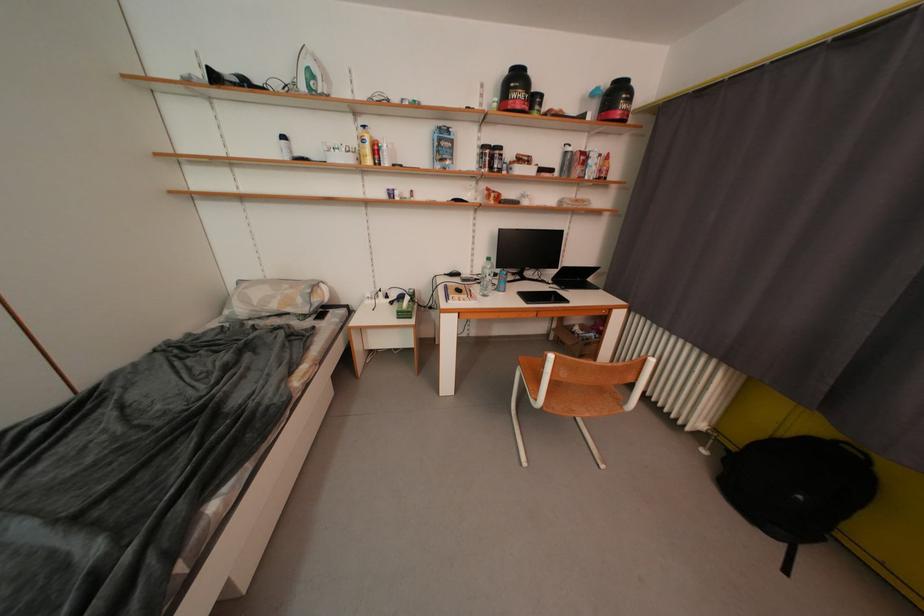
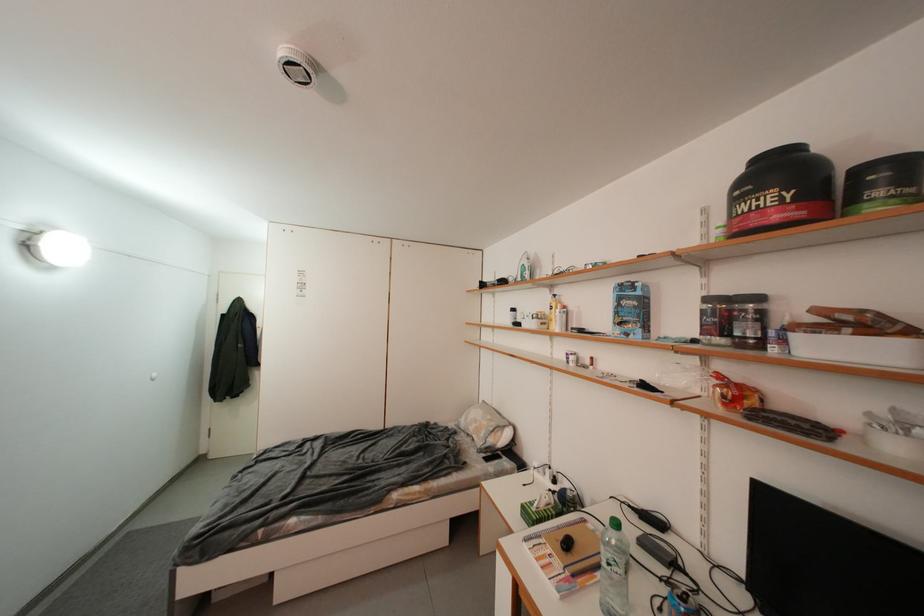
Locate, in the second image, the point that corresponds to the point at 517,172 in the first image.

(792, 345)